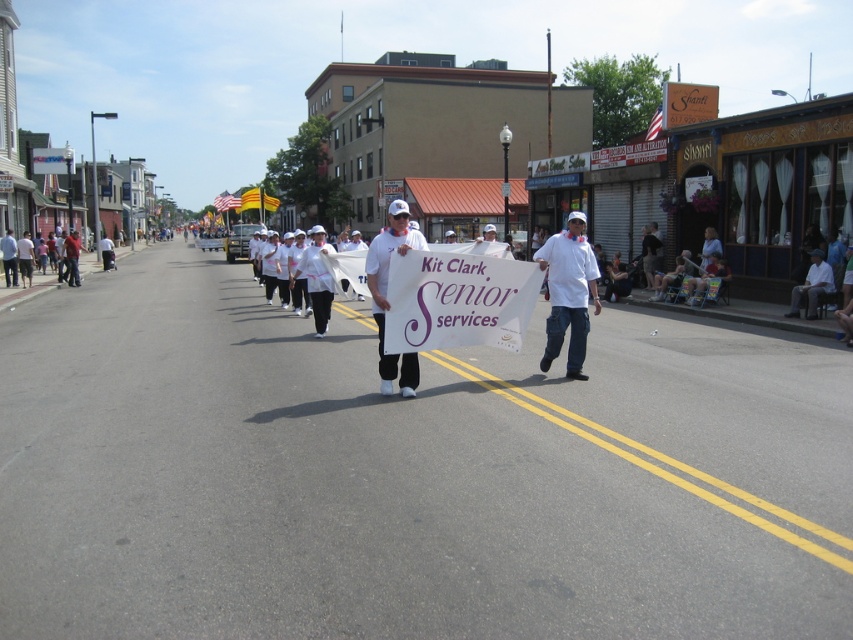
You are a pedestrian standing on the sidewalk and see the white matte sign at center and the white fabric at right. Which object is closer to the left side of the road?

The white matte sign at center is positioned on the left side of the white fabric at right, so it is closer to the left side of the road.

You are a pedestrian standing on the sidewalk and see the white matte sign at center and the white fabric at right. Which object is closer to the ground?

The white matte sign at center is closer to the ground because it is below the white fabric at right.